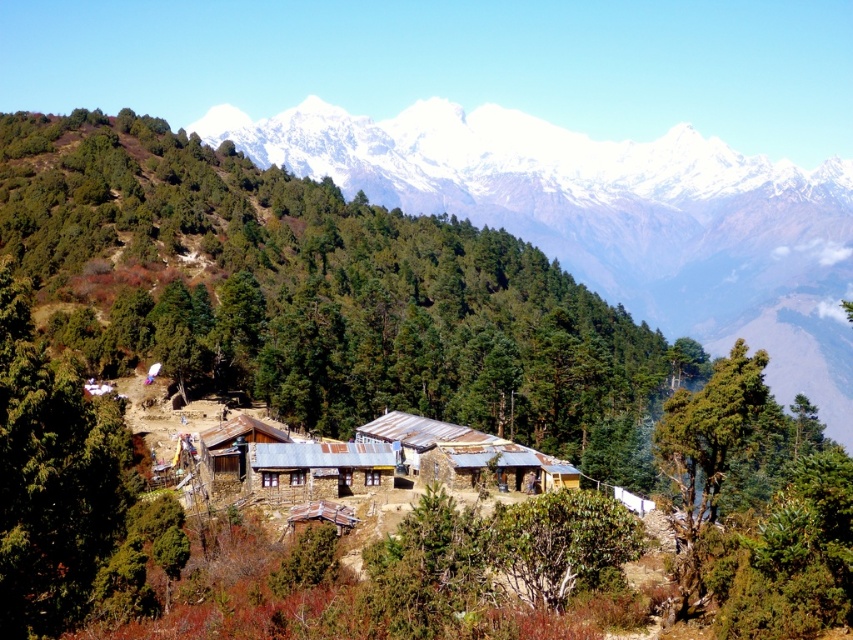
Which is more to the right, brown stone hut at center or brown wooden hut at center?

From the viewer's perspective, brown stone hut at center appears more on the right side.

Can you confirm if brown stone hut at center is positioned to the right of brown wooden hut at center?

Yes, brown stone hut at center is to the right of brown wooden hut at center.

This screenshot has height=640, width=853. What do you see at coordinates (318, 468) in the screenshot? I see `brown stone hut at center` at bounding box center [318, 468].

Identify the location of brown stone hut at center. (318, 468).

Which of these two, snowy white mountain range at upper center or wooden hut at center, stands shorter?

Standing shorter between the two is wooden hut at center.

Who is positioned more to the right, snowy white mountain range at upper center or wooden hut at center?

snowy white mountain range at upper center

Identify the location of snowy white mountain range at upper center. (614, 220).

Does snowy white mountain range at upper center have a greater height compared to brown wooden hut at center?

Yes.

Is point (339, 120) more distant than point (218, 456)?

Yes.

The width and height of the screenshot is (853, 640). Find the location of `snowy white mountain range at upper center`. snowy white mountain range at upper center is located at coordinates (614, 220).